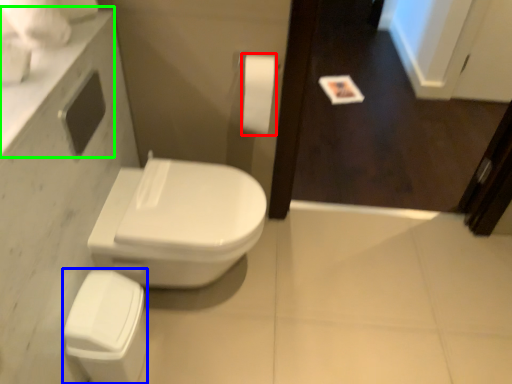
Question: Which is farther away from toilet paper (highlighted by a red box)? porcelain (highlighted by a blue box) or counter top (highlighted by a green box)?

Choices:
 (A) porcelain
 (B) counter top

Answer: (A)